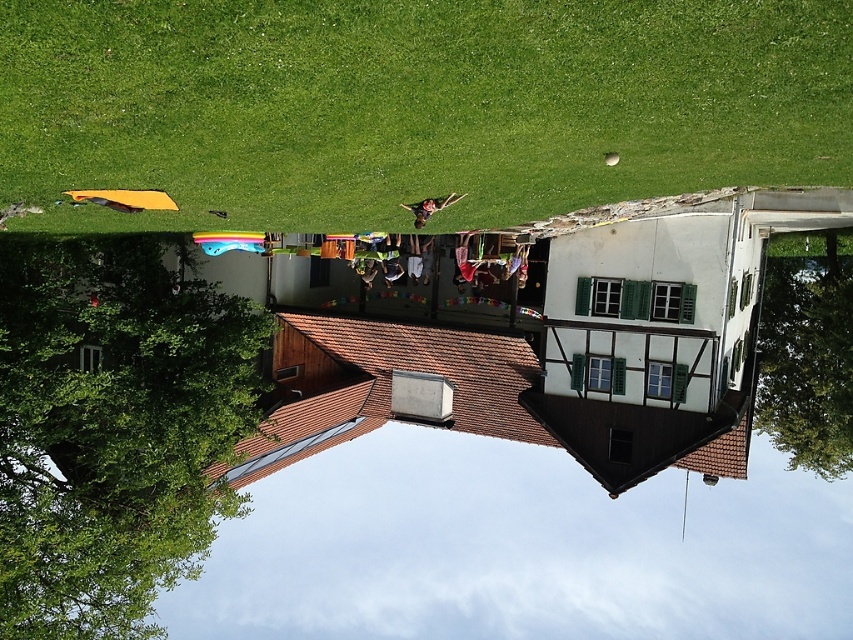
Question: Which of the following is the farthest from the observer?

Choices:
 (A) (834, 64)
 (B) (157, 284)

Answer: (B)

Question: Is green grass at upper left behind green leafy tree at lower right?

Choices:
 (A) yes
 (B) no

Answer: (B)

Question: Which point is closer to the camera?

Choices:
 (A) (108, 61)
 (B) (24, 310)

Answer: (A)

Question: Can you confirm if green leafy tree at left is thinner than green leafy tree at lower right?

Choices:
 (A) yes
 (B) no

Answer: (B)

Question: Which of the following is the farthest from the observer?

Choices:
 (A) green leafy tree at left
 (B) green grass at upper left
 (C) green leafy tree at lower right

Answer: (C)

Question: Can you confirm if green grass at upper left is smaller than green leafy tree at lower right?

Choices:
 (A) no
 (B) yes

Answer: (B)